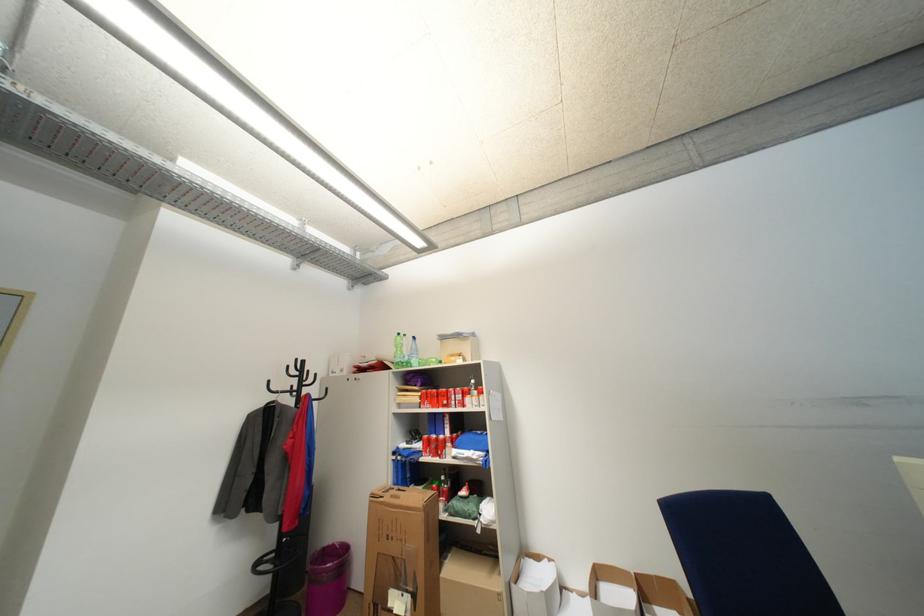
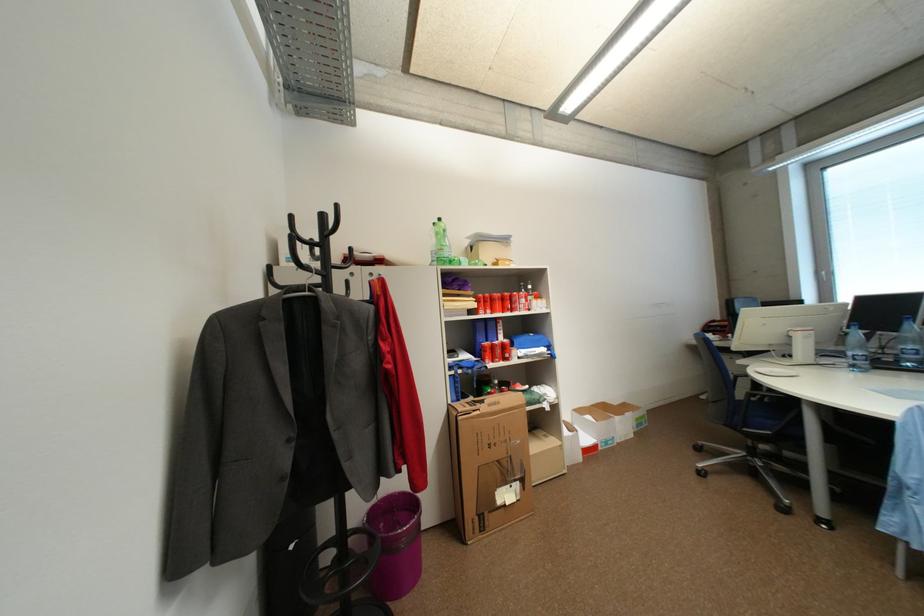
Where in the second image is the point corresponding to (x=429, y=398) from the first image?

(485, 302)